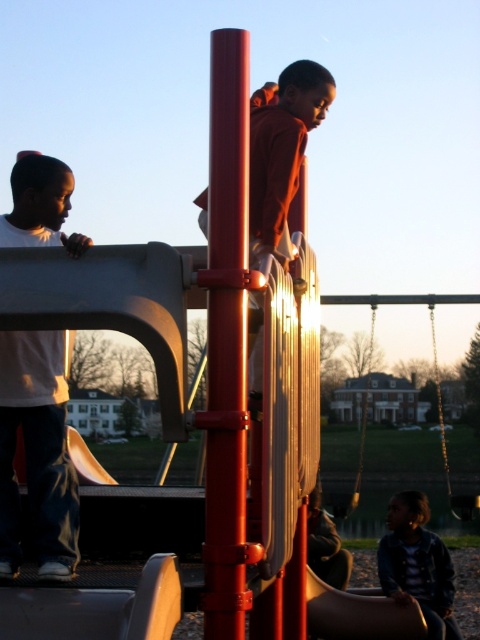
You are a parent at the playground and see your child wearing a denim jacket at lower right. You want to reach them quickly. Which direction should you walk from the wooden swing at right to find them?

The denim jacket at lower right is located below the wooden swing at right, so you should walk downward from the wooden swing at right to reach the denim jacket at lower right.

You are standing at the entrance of the playground and see the point marked at coordinate (282, 150). What object is located at that point?

The point at coordinate (282, 150) corresponds to the matte orange hoodie at center.

You are a parent at the playground and you see a child wearing a matte orange hoodie at center and another child wearing a denim jacket at lower right. Which child is more to the left?

The matte orange hoodie at center is more to the left than the denim jacket at lower right.